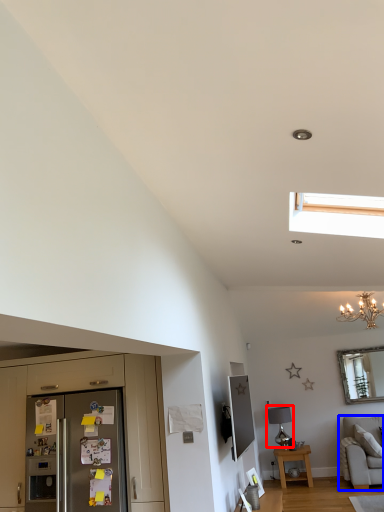
Question: Which object appears farthest to the camera in this image, lamp (highlighted by a red box) or studio couch (highlighted by a blue box)?

Choices:
 (A) lamp
 (B) studio couch

Answer: (A)